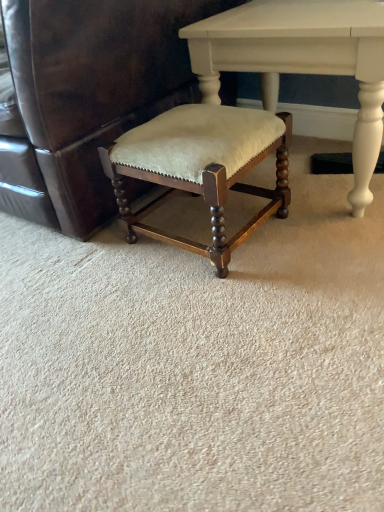
Find the location of a particular element. This screenshot has height=512, width=384. vacant area situated to the left side of velvet beige stool at center is located at coordinates (87, 267).